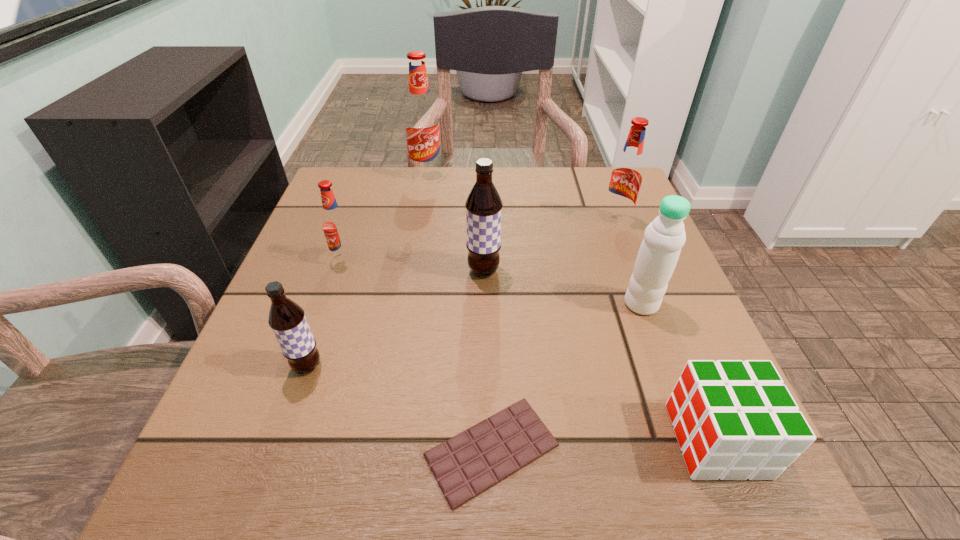
Find the location of `root beer that is the fourth closest one to the fourth nearest object`. root beer that is the fourth closest one to the fourth nearest object is located at coordinates (287, 320).

Identify which root beer is the fourth closest to the rightmost red root beer. Please provide its 2D coordinates. Your answer should be formatted as a tuple, i.e. [(x, y)], where the tuple contains the x and y coordinates of a point satisfying the conditions above.

[(287, 320)]

The width and height of the screenshot is (960, 540). I want to click on red root beer that is the third closest to the white water bottle, so click(422, 126).

At what (x,y) coordinates should I click in order to perform the action: click on red root beer that can be found as the second closest to the smallest red root beer. Please return your answer as a coordinate pair (x, y). Looking at the image, I should click on (626, 176).

Where is `free space that satisfies the following two spatial constraints: 1. on the back side of the second smallest red root beer; 2. on the right side of the white water bottle`? The width and height of the screenshot is (960, 540). free space that satisfies the following two spatial constraints: 1. on the back side of the second smallest red root beer; 2. on the right side of the white water bottle is located at coordinates (611, 221).

The image size is (960, 540). Find the location of `free space that satisfies the following two spatial constraints: 1. on the back side of the white water bottle; 2. on the left side of the third nearest object`. free space that satisfies the following two spatial constraints: 1. on the back side of the white water bottle; 2. on the left side of the third nearest object is located at coordinates (329, 304).